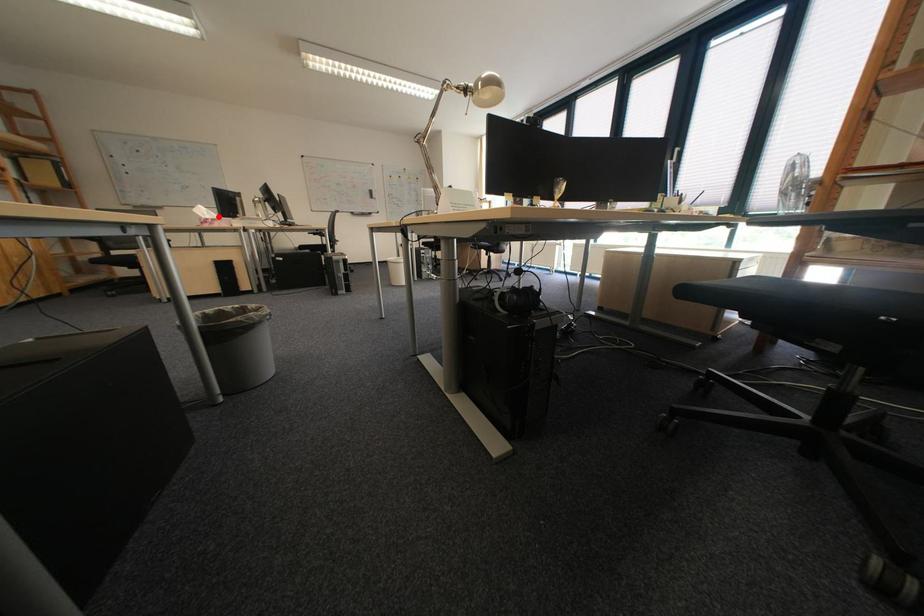
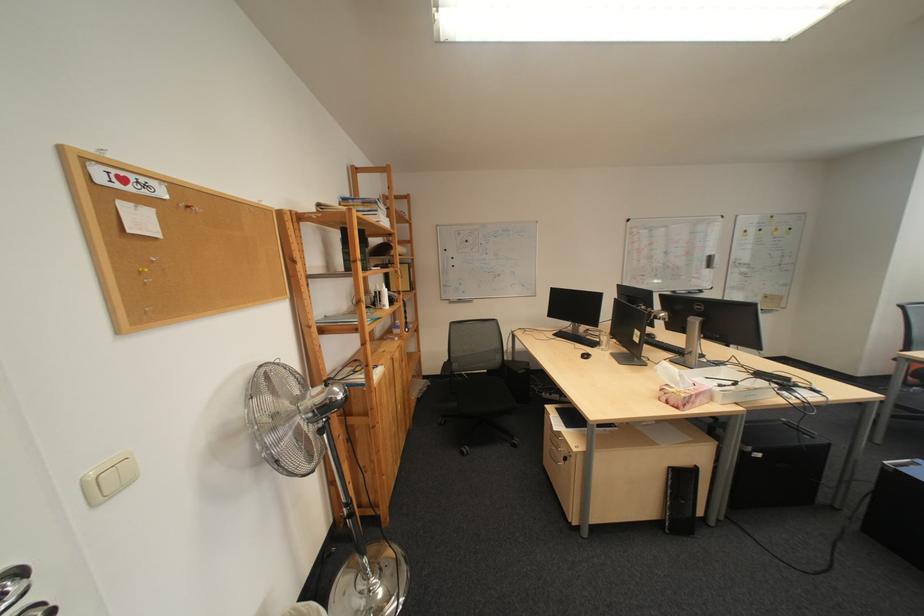
The point at the highlighted location is marked in the first image. Where is the corresponding point in the second image?

(690, 385)